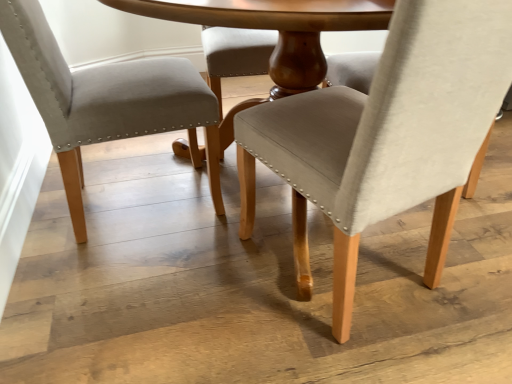
The width and height of the screenshot is (512, 384). I want to click on free spot in front of matte beige fabric chair at center, marked as the 1th chair in a right-to-left arrangement, so click(359, 350).